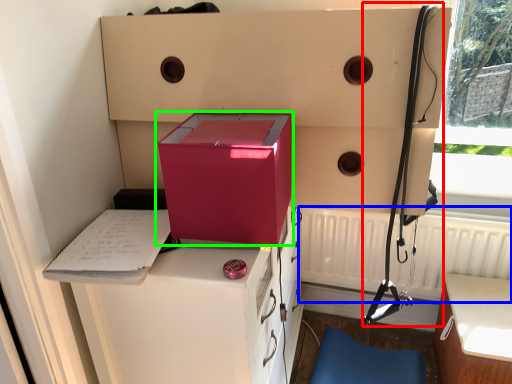
Question: Which is nearer to the twin (highlighted by a red box)? radiator (highlighted by a blue box) or box (highlighted by a green box).

Choices:
 (A) radiator
 (B) box

Answer: (A)